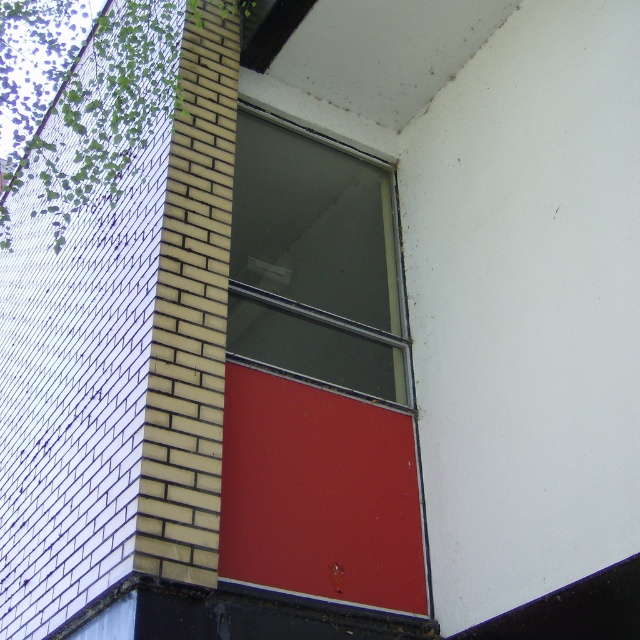
You are standing in front of a building and see a matte red door at center and a transparent glass window at center. Which object is nearer to you?

The matte red door at center is closer to the viewer than the transparent glass window at center.

You are a delivery person trying to deliver a package to the apartment behind the matte red door at center. The package can only be placed at the base of the door if it is at least as tall as the transparent glass window at center. Is the door tall enough?

The matte red door at center is shorter than the transparent glass window at center, so it is not tall enough to place the package at its base.